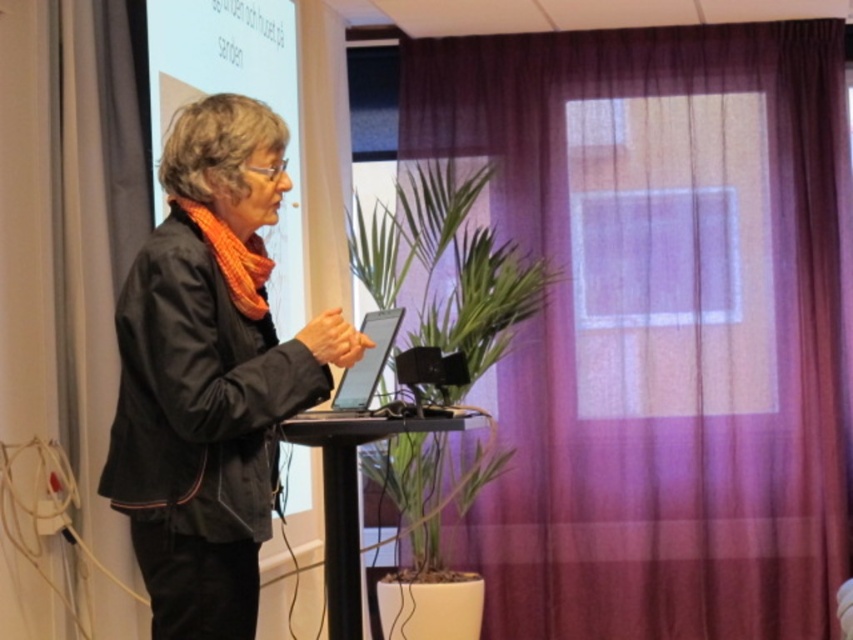
What do you see at coordinates (442, 276) in the screenshot? The image size is (853, 640). I see `green leafy plant at center` at bounding box center [442, 276].

Which is more to the right, green leafy plant at center or orange knitted scarf at left?

Positioned to the right is green leafy plant at center.

What do you see at coordinates (442, 276) in the screenshot? I see `green leafy plant at center` at bounding box center [442, 276].

Locate an element on the screen. The height and width of the screenshot is (640, 853). green leafy plant at center is located at coordinates (442, 276).

You are a GUI agent. You are given a task and a screenshot of the screen. Output one action in this format:
    pyautogui.click(x=<x>, y=<y>)
    Task: Click on the purple sheer curtain at center
    This screenshot has height=640, width=853.
    Given the screenshot: What is the action you would take?
    click(x=660, y=324)

Is point (825, 460) in front of point (305, 385)?

No.

This screenshot has width=853, height=640. What do you see at coordinates (660, 324) in the screenshot?
I see `purple sheer curtain at center` at bounding box center [660, 324].

Where is `purple sheer curtain at center`? Image resolution: width=853 pixels, height=640 pixels. purple sheer curtain at center is located at coordinates (660, 324).

Is black matte jacket at left thinner than orange knitted scarf at left?

In fact, black matte jacket at left might be wider than orange knitted scarf at left.

Does point (251, 419) lie behind point (231, 292)?

No, it is not.

Where is `black matte jacket at left`? black matte jacket at left is located at coordinates (210, 372).